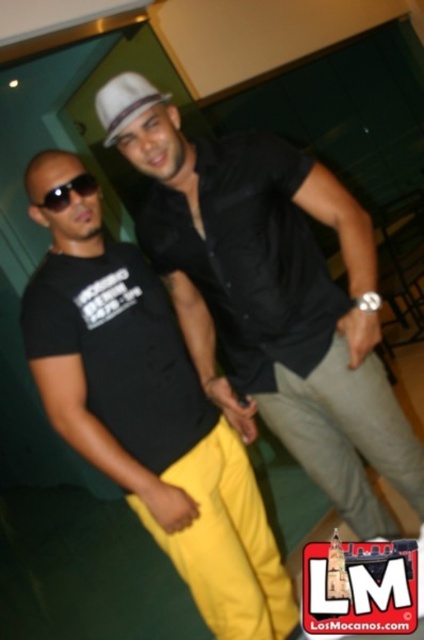
Is matte black shirt at center positioned behind black matte sunglasses at left?

That is True.

Between matte black shirt at center and black matte sunglasses at left, which one appears on the left side from the viewer's perspective?

Positioned to the left is black matte sunglasses at left.

Locate an element on the screen. matte black shirt at center is located at coordinates (278, 304).

In order to click on matte black shirt at center in this screenshot , I will do `click(278, 304)`.

Is matte black shirt at center to the right of black matte t-shirt at center from the viewer's perspective?

Yes, matte black shirt at center is to the right of black matte t-shirt at center.

Is matte black shirt at center positioned at the back of black matte t-shirt at center?

Yes, matte black shirt at center is behind black matte t-shirt at center.

Between point (187, 307) and point (178, 378), which one is positioned in front?

Point (178, 378)

I want to click on matte black shirt at center, so click(x=278, y=304).

Who is lower down, black matte t-shirt at center or black matte sunglasses at left?

black matte t-shirt at center

Does black matte t-shirt at center appear over black matte sunglasses at left?

No.

The height and width of the screenshot is (640, 424). Find the location of `black matte t-shirt at center`. black matte t-shirt at center is located at coordinates (147, 412).

You are a GUI agent. You are given a task and a screenshot of the screen. Output one action in this format:
    pyautogui.click(x=<x>, y=<y>)
    Task: Click on the black matte t-shirt at center
    This screenshot has width=424, height=640.
    Given the screenshot: What is the action you would take?
    147,412